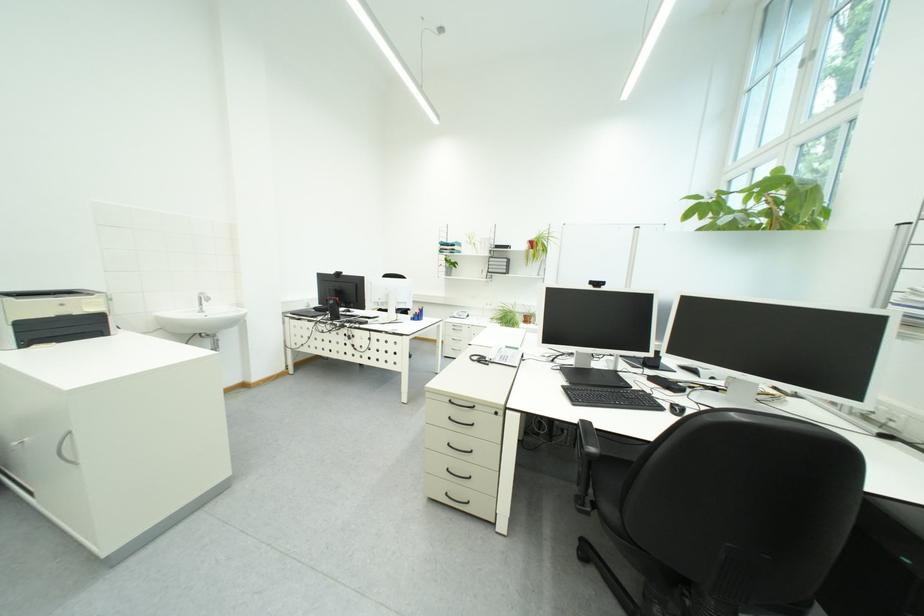
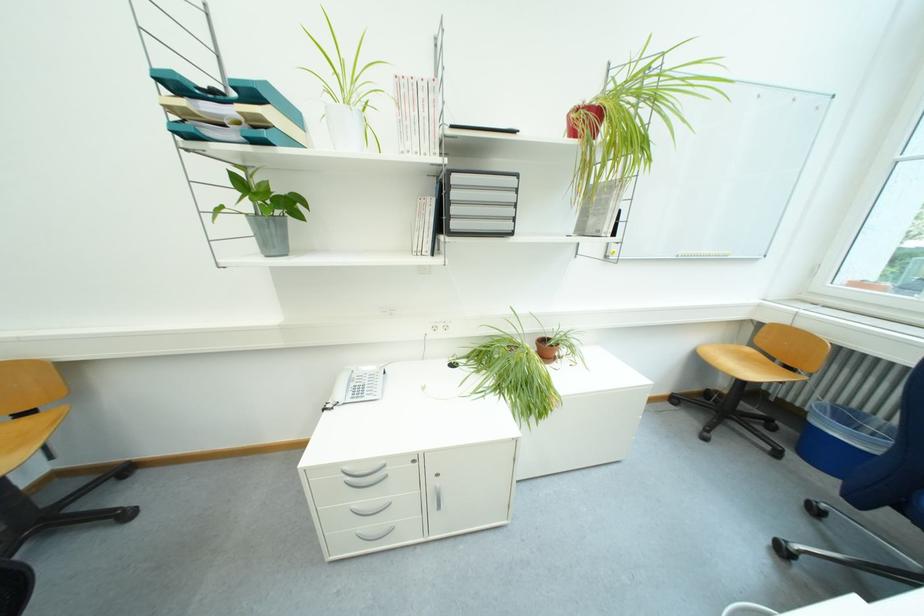
Locate, in the second image, the point that corresponds to pixel 466 265 in the first image.

(302, 206)